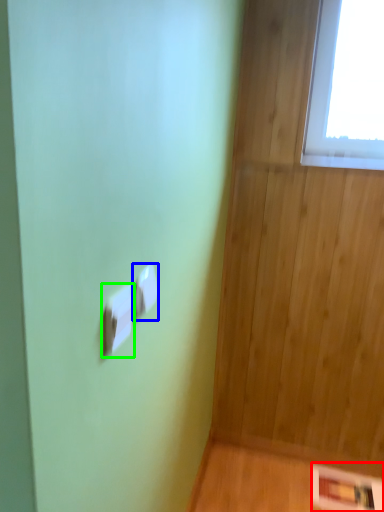
Question: Which object is the farthest from panel (highlighted by a red box)? Choose among these: light switch (highlighted by a blue box) or light switch (highlighted by a green box).

Choices:
 (A) light switch
 (B) light switch

Answer: (B)